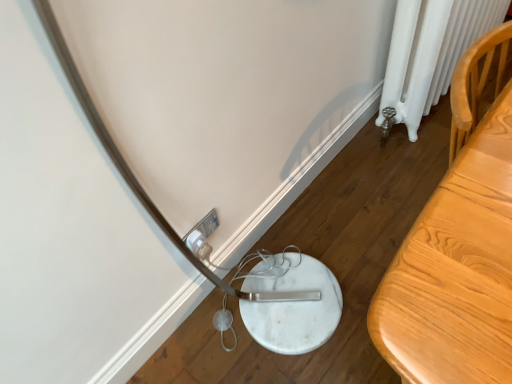
Question: Is white painted radiator at right to the left of light wood table at right from the viewer's perspective?

Choices:
 (A) yes
 (B) no

Answer: (B)

Question: From the image's perspective, does white painted radiator at right appear lower than light wood table at right?

Choices:
 (A) yes
 (B) no

Answer: (B)

Question: Is white painted radiator at right closer to the viewer compared to light wood table at right?

Choices:
 (A) yes
 (B) no

Answer: (B)

Question: Would you say white painted radiator at right is outside light wood table at right?

Choices:
 (A) no
 (B) yes

Answer: (B)

Question: Is white painted radiator at right turned away from light wood table at right?

Choices:
 (A) no
 (B) yes

Answer: (A)

Question: Is white painted radiator at right bigger than light wood table at right?

Choices:
 (A) no
 (B) yes

Answer: (B)

Question: From the image's perspective, is light wood table at right located above white plastic electric outlet at lower center?

Choices:
 (A) no
 (B) yes

Answer: (B)

Question: Does light wood table at right have a smaller size compared to white plastic electric outlet at lower center?

Choices:
 (A) no
 (B) yes

Answer: (A)

Question: Does light wood table at right appear on the right side of white plastic electric outlet at lower center?

Choices:
 (A) yes
 (B) no

Answer: (A)

Question: Does light wood table at right turn towards white plastic electric outlet at lower center?

Choices:
 (A) no
 (B) yes

Answer: (A)

Question: Is light wood table at right taller than white plastic electric outlet at lower center?

Choices:
 (A) no
 (B) yes

Answer: (B)

Question: Is light wood table at right outside white plastic electric outlet at lower center?

Choices:
 (A) yes
 (B) no

Answer: (A)

Question: Is white plastic electric outlet at lower center next to light wood table at right?

Choices:
 (A) yes
 (B) no

Answer: (B)